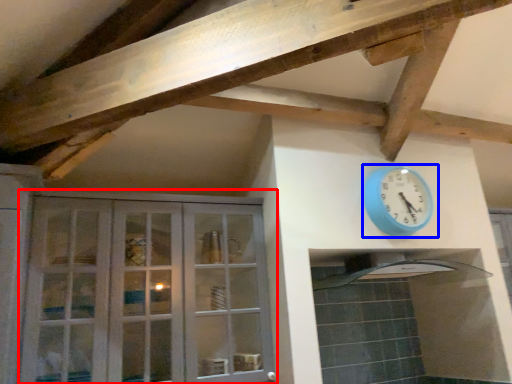
Question: Which point is further to the camera, cabinetry (highlighted by a red box) or wall clock (highlighted by a blue box)?

Choices:
 (A) cabinetry
 (B) wall clock

Answer: (B)